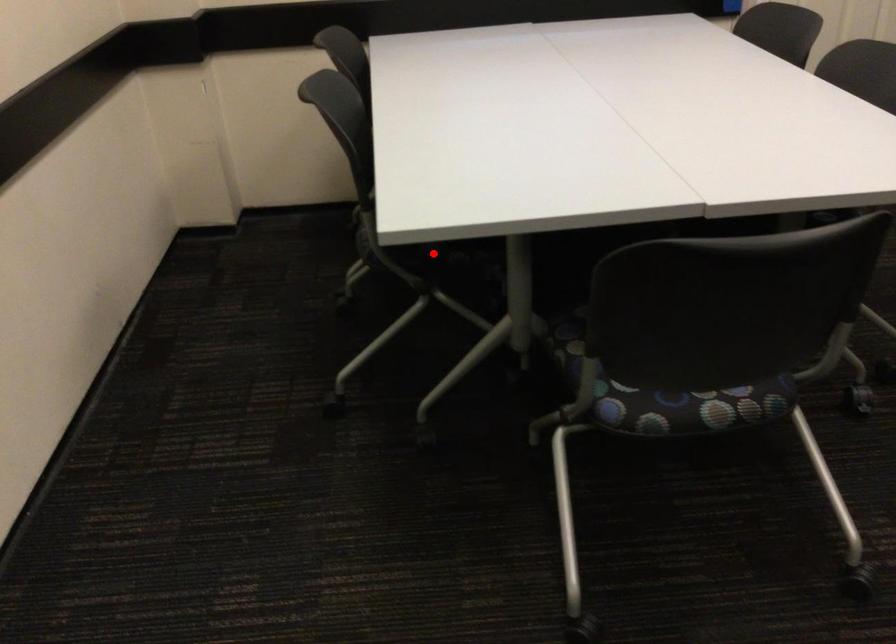
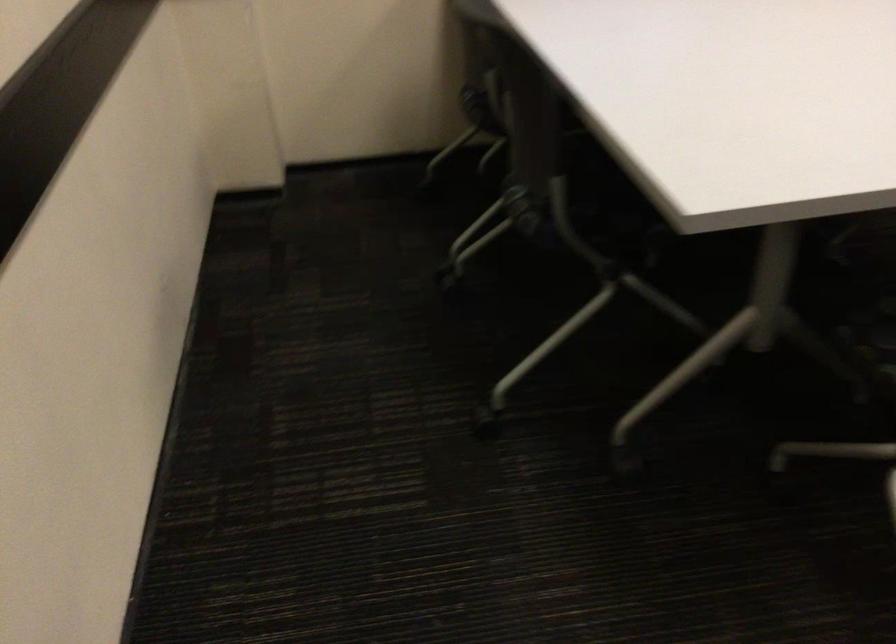
Question: A red point is marked in image1. In image2, is the corresponding 3D point closer to the camera or farther? Reply with the corresponding letter.

Choices:
 (A) The corresponding 3D point is closer.
 (B) The corresponding 3D point is farther.

Answer: (A)